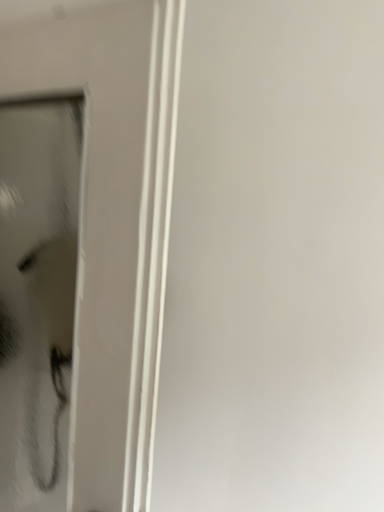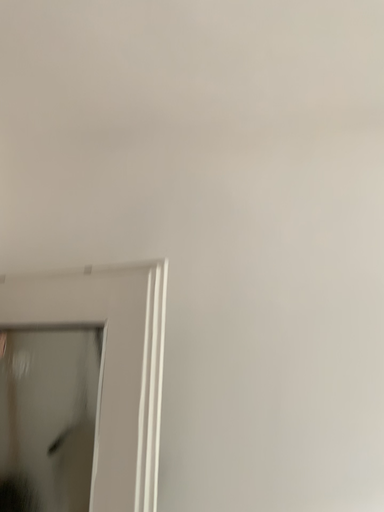
Question: Which way did the camera rotate in the video?

Choices:
 (A) rotated upward
 (B) rotated downward

Answer: (A)